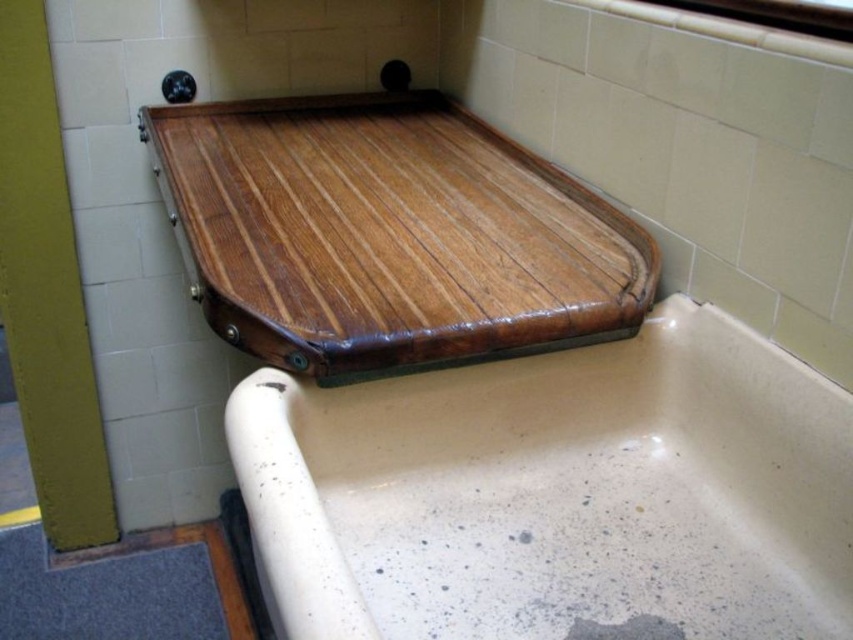
You are a contractor assessing the bathroom layout. You need to determine if the speckled ceramic bathtub at upper center can fit a new decorative item that requires a surface area larger than the wooden tray at upper center. Based on their sizes, is this possible?

The speckled ceramic bathtub at upper center is smaller than the wooden tray at upper center. Since the decorative item requires a surface area larger than the wooden tray at upper center, it cannot fit on the bathtub.

You are a contractor assessing the bathroom layout. You need to install a new shelf that must be at least 1.2 meters tall to hold heavy tools. Given the wooden tray at upper center and the speckled ceramic bathtub at upper center, which object can accommodate this requirement?

The wooden tray at upper center can accommodate the requirement because it has a greater height than the speckled ceramic bathtub at upper center, which is below the 1.2 meters needed.

You are a maintenance worker inspecting the bathroom. You notice the wooden tray at upper center and the speckled ceramic bathtub at upper center. Which object is nearer to you?

The speckled ceramic bathtub at upper center is closer to the viewer than the wooden tray at upper center, so the bathtub is nearer.